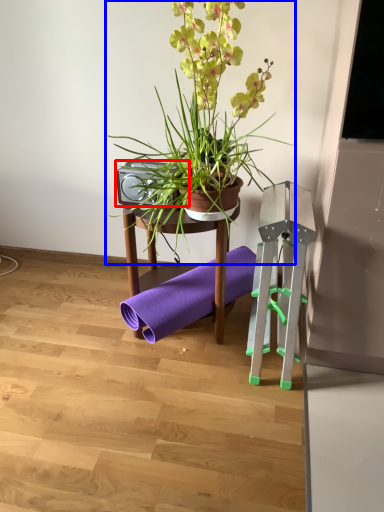
Question: Which of the following is the farthest to the observer, speaker (highlighted by a red box) or houseplant (highlighted by a blue box)?

Choices:
 (A) speaker
 (B) houseplant

Answer: (A)